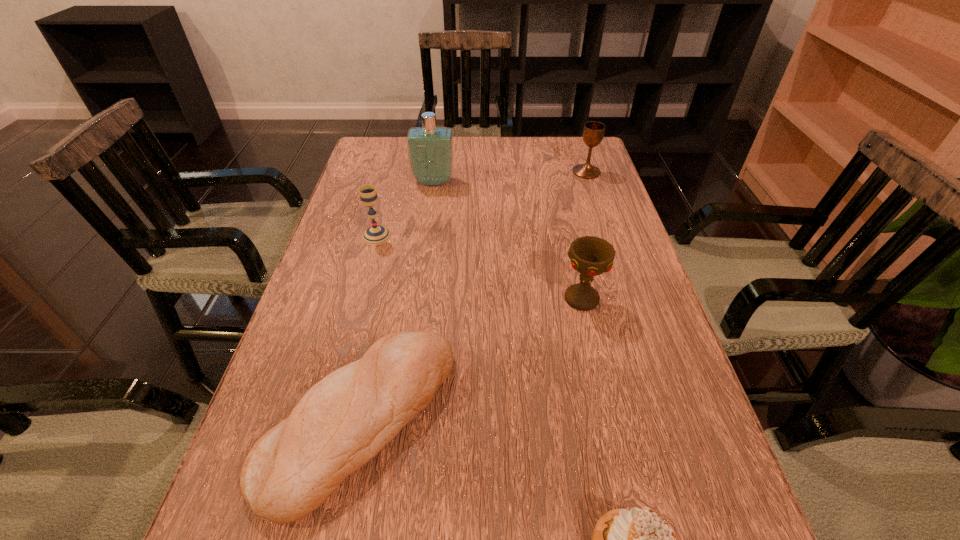
The image size is (960, 540). Find the location of `the tallest object`. the tallest object is located at coordinates (430, 149).

Identify the location of the rightmost object. (593, 132).

Identify the location of the farthest chalice. The width and height of the screenshot is (960, 540). (593, 132).

Identify the location of the third nearest object. click(591, 256).

I want to click on the second chalice from left to right, so click(x=591, y=256).

You are a GUI agent. You are given a task and a screenshot of the screen. Output one action in this format:
    pyautogui.click(x=<x>, y=<y>)
    Task: Click on the second farthest chalice
    This screenshot has height=540, width=960.
    Given the screenshot: What is the action you would take?
    pyautogui.click(x=376, y=234)

Find the location of a particular element. the third farthest object is located at coordinates (376, 234).

The image size is (960, 540). I want to click on bread, so click(x=342, y=422).

Find the location of a particular element. vacant space situated on the front label of the perfume is located at coordinates (423, 259).

Find the location of a particular element. The width and height of the screenshot is (960, 540). free space located on the front of the rightmost chalice is located at coordinates (610, 242).